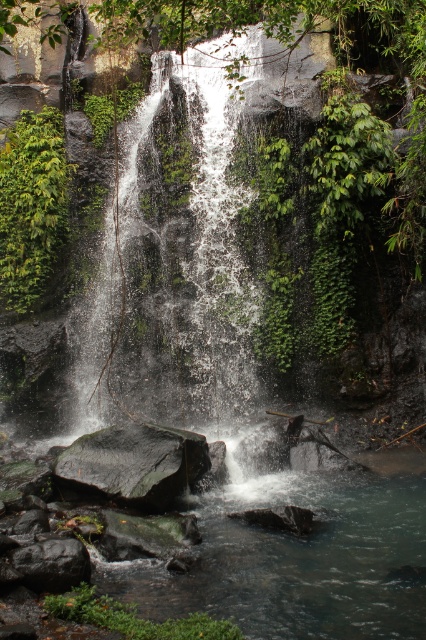
You are standing at the point marked by point [31,205] and want to move towards the waterfall. Which direction should you go to avoid the green leafy plant at left?

The point [31,205] is the location of the green leafy plant at left, so you should move away from that point towards the waterfall direction to avoid it.

In the scene shown: You are a hiker who wants to place a small statue between the green leafy plant at left and the green mossy rock at lower center. Which object should you use as a reference for the statue placement to ensure it is taller than both?

The green leafy plant at left is taller than the green mossy rock at lower center. To ensure the statue is taller than both, you should use the green leafy plant at left as the reference for placement.

You are a geologist examining the waterfall area. You need to place a 10 cm measurement marker on the largest rock in the scene. Which rock should you choose between the black smooth rock at center and the dark gray rock at lower left?

The black smooth rock at center is larger in size than the dark gray rock at lower left, so you should place the 10 cm measurement marker on the black smooth rock at center.